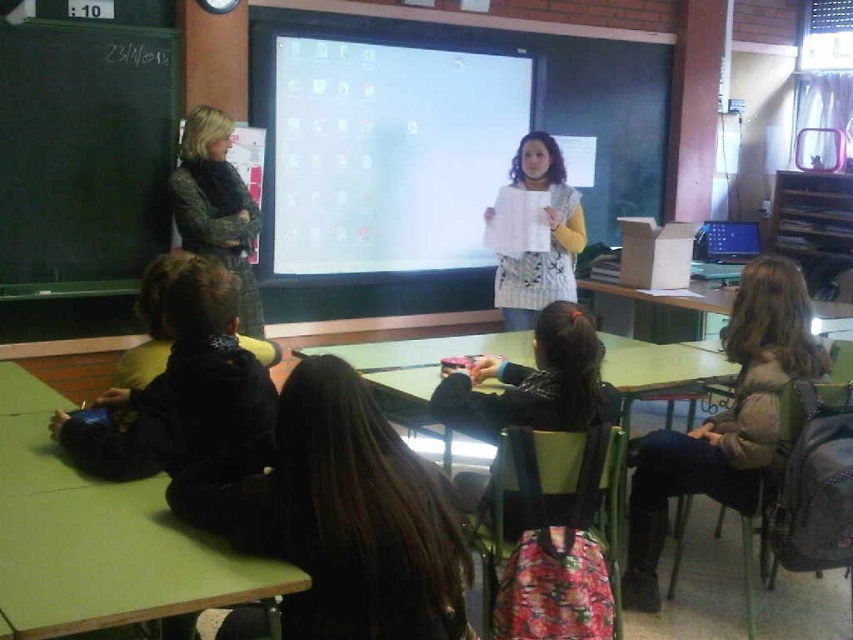
Question: Which point is farther from the camera taking this photo?

Choices:
 (A) (531, 180)
 (B) (756, 376)

Answer: (A)

Question: Is black matte jacket at center below light brown woolen sweater at lower right?

Choices:
 (A) no
 (B) yes

Answer: (B)

Question: Where is white glossy screen at center located in relation to camouflage-patterned sweater at left in the image?

Choices:
 (A) left
 (B) right

Answer: (B)

Question: Among these objects, which one is farthest from the camera?

Choices:
 (A) white glossy screen at center
 (B) camouflage-patterned sweater at left
 (C) light brown woolen sweater at lower right
 (D) white knitted sweater at center

Answer: (A)

Question: Does black matte jacket at center have a larger size compared to camouflage-patterned sweater at left?

Choices:
 (A) no
 (B) yes

Answer: (B)

Question: Which point is closer to the camera?

Choices:
 (A) (646, 550)
 (B) (218, 120)
 (C) (518, 113)

Answer: (A)